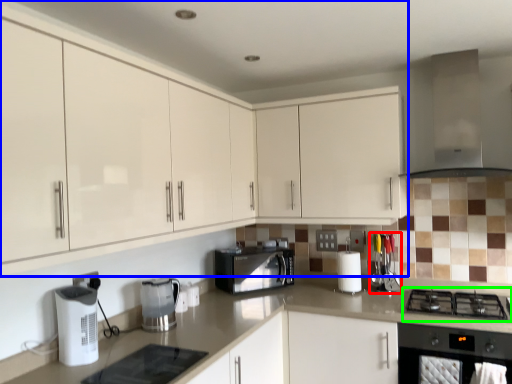
Question: Which object is positioned closest to appliance (highlighted by a red box)? Select from cabinetry (highlighted by a blue box) and gas stove (highlighted by a green box).

Choices:
 (A) cabinetry
 (B) gas stove

Answer: (B)